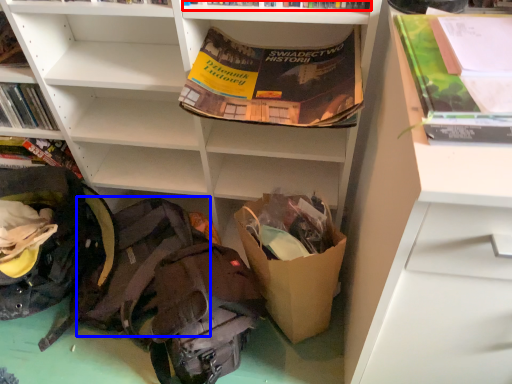
Question: Which object appears farthest to the camera in this image, book (highlighted by a red box) or backpack (highlighted by a blue box)?

Choices:
 (A) book
 (B) backpack

Answer: (B)